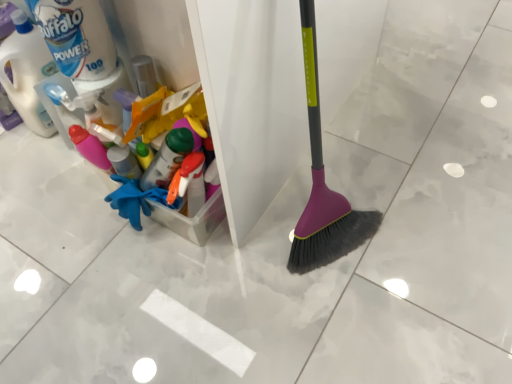
Question: Considering the positions of point (47, 18) and point (41, 59), is point (47, 18) closer or farther from the camera than point (41, 59)?

Choices:
 (A) farther
 (B) closer

Answer: (B)

Question: Which is correct: matte white bottle at upper left is inside matte white bottle at left, or outside of it?

Choices:
 (A) inside
 (B) outside

Answer: (B)

Question: Considering the positions of matte white bottle at upper left and matte white bottle at left in the image, is matte white bottle at upper left taller or shorter than matte white bottle at left?

Choices:
 (A) short
 (B) tall

Answer: (A)

Question: In terms of width, does matte white bottle at left look wider or thinner when compared to matte white bottle at upper left?

Choices:
 (A) thin
 (B) wide

Answer: (B)

Question: Considering the relative positions of matte white bottle at left and matte white bottle at upper left in the image provided, is matte white bottle at left to the left or to the right of matte white bottle at upper left?

Choices:
 (A) left
 (B) right

Answer: (A)

Question: From the image's perspective, relative to matte white bottle at upper left, is matte white bottle at left above or below?

Choices:
 (A) below
 (B) above

Answer: (A)

Question: Considering the positions of matte white bottle at left and matte white bottle at upper left in the image, is matte white bottle at left taller or shorter than matte white bottle at upper left?

Choices:
 (A) short
 (B) tall

Answer: (B)